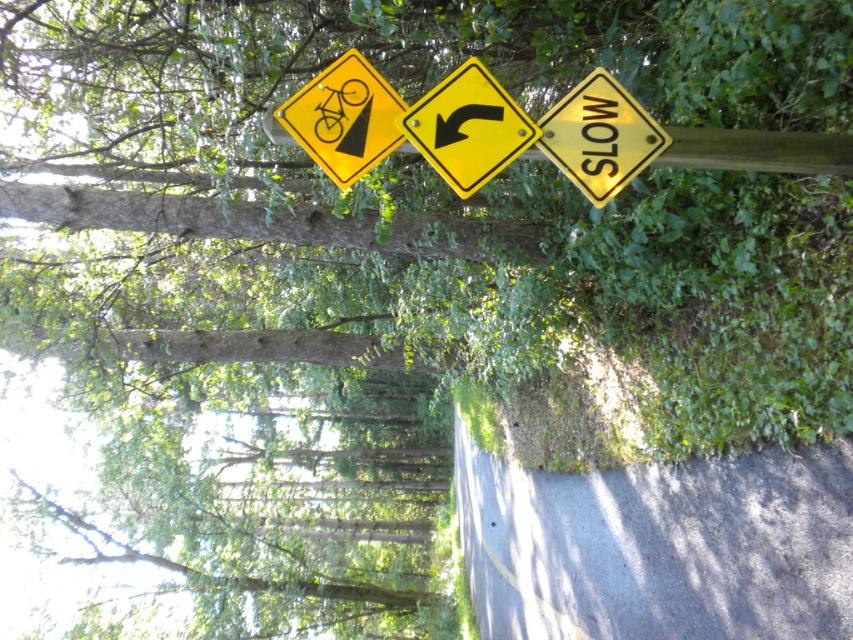
Looking at this image, you are a driver approaching the road signs mounted on the wooden post. You notice two points marked on the signs. The first point is at coordinates point (383, 134) and the second point is at point (553, 113). Which point is closer to you as you look at the signs?

Point (383, 134) is further to the camera than point (553, 113), so the point closer to you is point (553, 113).